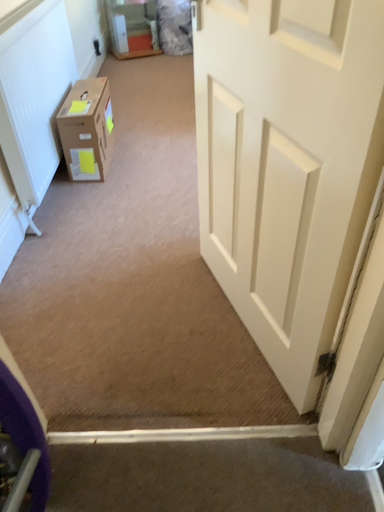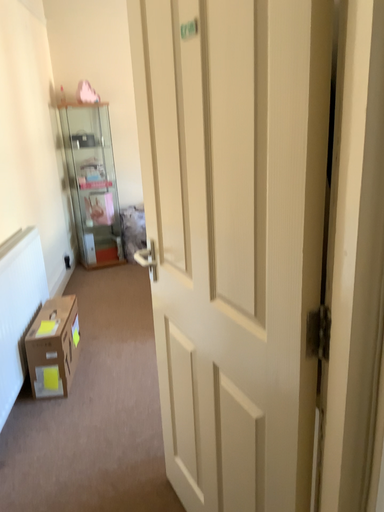
Question: How did the camera likely rotate when shooting the video?

Choices:
 (A) rotated downward
 (B) rotated upward

Answer: (B)